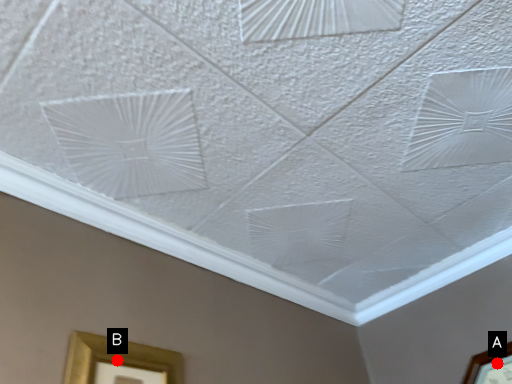
Question: Two points are circled on the image, labeled by A and B beside each circle. Which point appears farthest from the camera in this image?

Choices:
 (A) A is further
 (B) B is further

Answer: (A)